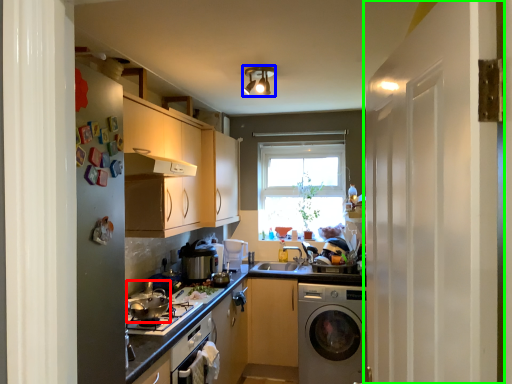
Question: Considering the real-world distances, which object is closest to appliance (highlighted by a red box)? light fixture (highlighted by a blue box) or screen door (highlighted by a green box).

Choices:
 (A) light fixture
 (B) screen door

Answer: (B)